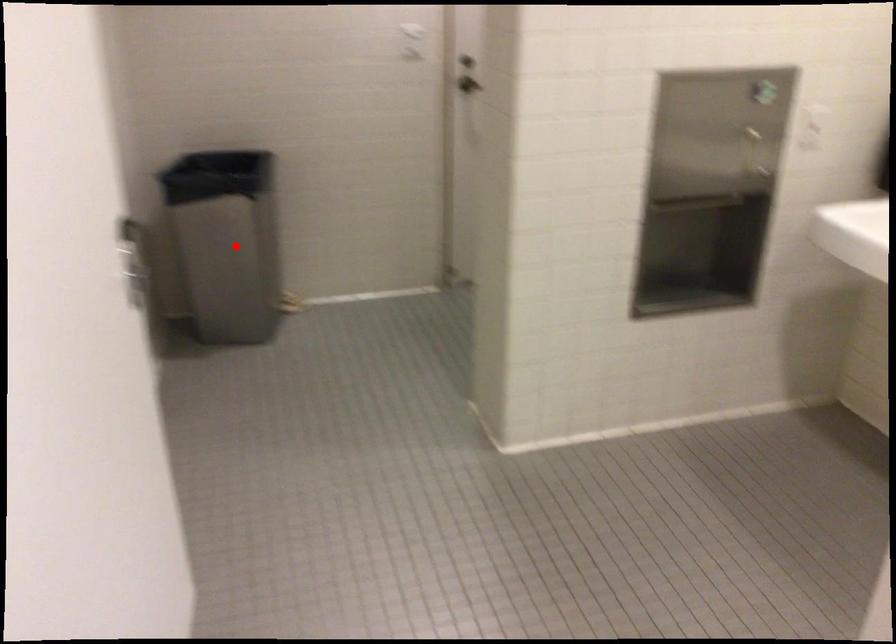
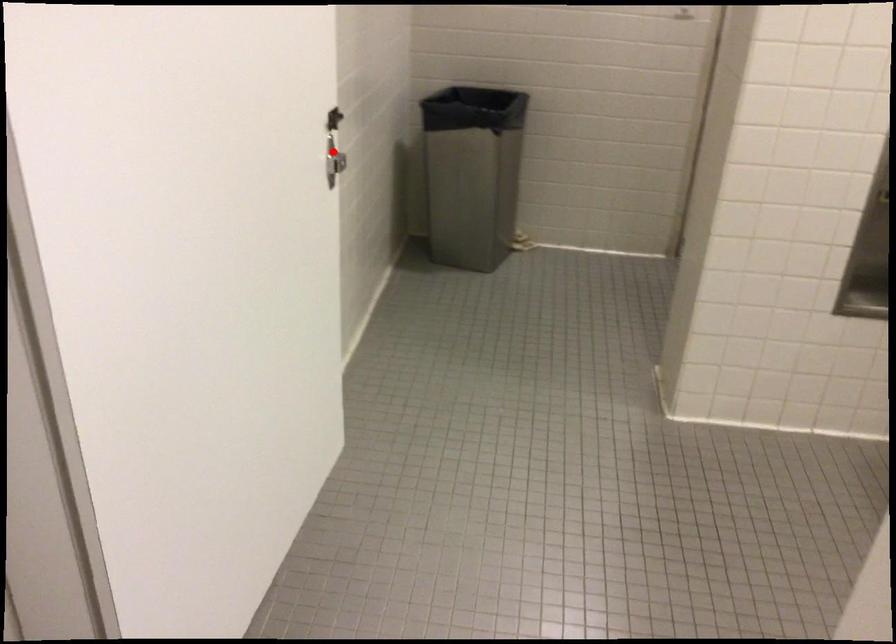
I am providing you with two images of the same scene from different viewpoints. A red point is marked on the first image and another point is marked on the second image. Do the highlighted points in image1 and image2 indicate the same real-world spot?

No